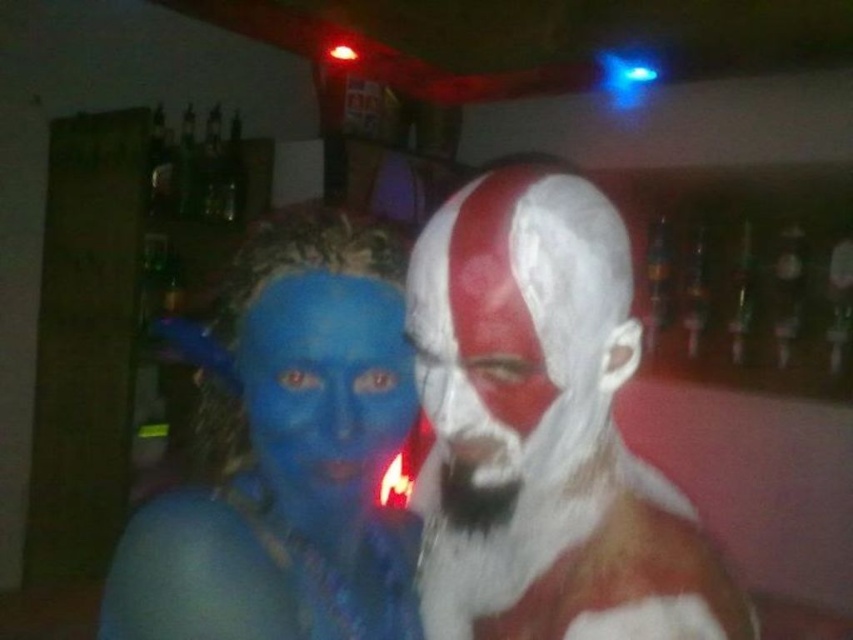
Based on the photo, you are standing in the bar and want to place a small decoration between the two points, point (563, 390) and point (372, 381). Which point should you place it closer to if you want it to be more visible to people entering the bar?

You should place the decoration closer to point (563, 390) because it is closer to the viewer, making it more visible to people entering the bar.

Looking at this image, you are a photographer trying to capture the perfect shot of the matte blue face paint at center and the white matte beard at center. Since you want to ensure both are visible, which object should you focus on first considering their sizes?

The matte blue face paint at center is taller than the white matte beard at center, so you should focus on the matte blue face paint at center first to ensure both are in frame.

You are a photographer trying to capture a portrait of both the white matte face paint at center and the matte blue face paint at center. Since you want to ensure both faces are fully visible, which face should you focus on first to avoid cropping the taller one?

The white matte face paint at center is taller than the matte blue face paint at center, so you should focus on the white matte face paint at center first to ensure it is fully captured in the frame.